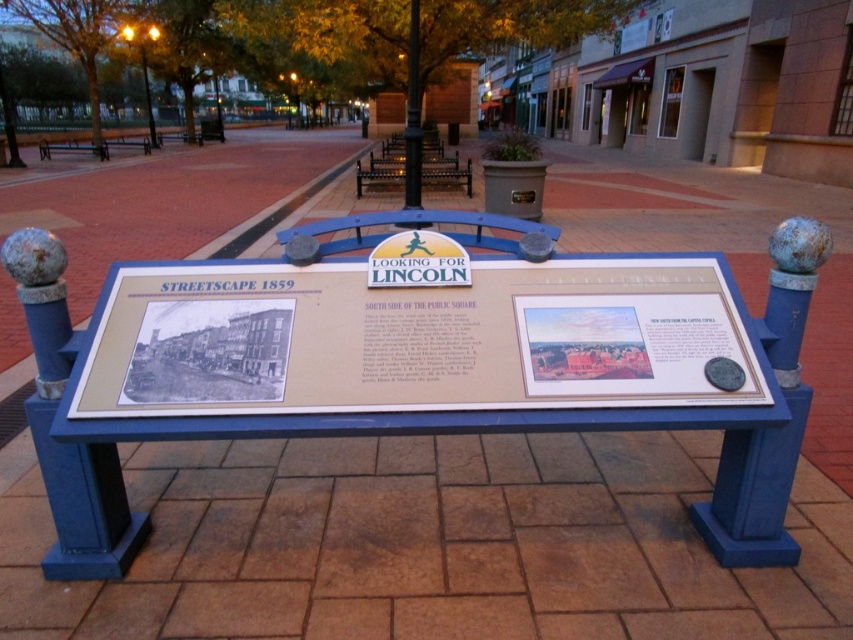
Question: Which point is farther from the camera taking this photo?

Choices:
 (A) (122, 138)
 (B) (738, 321)

Answer: (A)

Question: Does beige paper sign at center lie in front of blue painted wood bench at left?

Choices:
 (A) no
 (B) yes

Answer: (B)

Question: Is metallic dark brown bench at center further to camera compared to blue painted wood bench at left?

Choices:
 (A) no
 (B) yes

Answer: (A)

Question: Among these points, which one is farthest from the camera?

Choices:
 (A) (105, 150)
 (B) (387, 177)
 (C) (120, 136)

Answer: (C)

Question: Which of the following is the closest to the observer?

Choices:
 (A) (502, 273)
 (B) (108, 145)

Answer: (A)

Question: Does blue painted wood bench at left appear on the right side of blue painted wood bench at upper left?

Choices:
 (A) no
 (B) yes

Answer: (B)